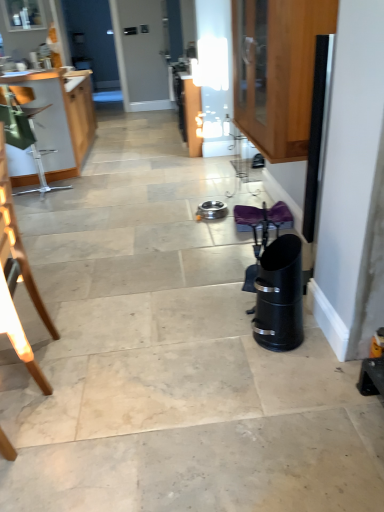
What do you see at coordinates (62, 118) in the screenshot?
I see `wooden cabinet at left, acting as the 2th cabinetry starting from the front` at bounding box center [62, 118].

What do you see at coordinates (17, 278) in the screenshot? This screenshot has height=512, width=384. I see `wooden chair at left` at bounding box center [17, 278].

You are a GUI agent. You are given a task and a screenshot of the screen. Output one action in this format:
    pyautogui.click(x=<x>, y=<y>)
    Task: Click on the wooden cabinet at upper right, which appears as the 1th cabinetry when viewed from the front
    The image size is (384, 512).
    Given the screenshot: What is the action you would take?
    pyautogui.click(x=277, y=71)

This screenshot has height=512, width=384. What do you see at coordinates (277, 71) in the screenshot?
I see `wooden cabinet at upper right, which appears as the 1th cabinetry when viewed from the front` at bounding box center [277, 71].

You are a GUI agent. You are given a task and a screenshot of the screen. Output one action in this format:
    pyautogui.click(x=<x>, y=<y>)
    Task: Click on the wooden cabinet at left, which is the first cabinetry in left-to-right order
    
    Given the screenshot: What is the action you would take?
    pyautogui.click(x=62, y=118)

Is wooden chair at left positioned behind wooden cabinet at left, which is the first cabinetry in left-to-right order?

That is False.

From the image's perspective, is wooden chair at left beneath wooden cabinet at left, which is the first cabinetry in left-to-right order?

Correct, wooden chair at left appears lower than wooden cabinet at left, which is the first cabinetry in left-to-right order, in the image.

Is wooden chair at left next to wooden cabinet at left, which is the first cabinetry in left-to-right order?

No, wooden chair at left is not making contact with wooden cabinet at left, which is the first cabinetry in left-to-right order.

Which object is positioned more to the left, wooden chair at left or wooden cabinet at left, which is the first cabinetry in left-to-right order?

From the viewer's perspective, wooden cabinet at left, which is the first cabinetry in left-to-right order, appears more on the left side.

Which of these two, wooden cabinet at left, the 2th cabinetry positioned from the right, or wooden cabinet at upper right, positioned as the 1th cabinetry in right-to-left order, is smaller?

wooden cabinet at upper right, positioned as the 1th cabinetry in right-to-left order.

Does wooden cabinet at left, which is the first cabinetry in left-to-right order, turn towards wooden cabinet at upper right, placed as the 2th cabinetry when sorted from back to front?

No, wooden cabinet at left, which is the first cabinetry in left-to-right order, is not facing towards wooden cabinet at upper right, placed as the 2th cabinetry when sorted from back to front.

Where is `cabinetry that is above the wooden cabinet at left, acting as the 2th cabinetry starting from the front (from a real-world perspective)`? cabinetry that is above the wooden cabinet at left, acting as the 2th cabinetry starting from the front (from a real-world perspective) is located at coordinates (277, 71).

Is wooden cabinet at left, acting as the 2th cabinetry starting from the front, next to wooden cabinet at upper right, which appears as the 1th cabinetry when viewed from the front, and touching it?

No, wooden cabinet at left, acting as the 2th cabinetry starting from the front, is not in contact with wooden cabinet at upper right, which appears as the 1th cabinetry when viewed from the front.

Is wooden cabinet at upper right, positioned as the 1th cabinetry in right-to-left order, oriented towards wooden cabinet at left, acting as the 2th cabinetry starting from the front?

No, wooden cabinet at upper right, positioned as the 1th cabinetry in right-to-left order, is not oriented towards wooden cabinet at left, acting as the 2th cabinetry starting from the front.

Is wooden cabinet at upper right, placed as the 2th cabinetry when sorted from back to front, next to wooden cabinet at left, which is the first cabinetry in left-to-right order?

wooden cabinet at upper right, placed as the 2th cabinetry when sorted from back to front, and wooden cabinet at left, which is the first cabinetry in left-to-right order, are not in contact.

Considering the sizes of objects wooden cabinet at upper right, which ranks as the 2th cabinetry in left-to-right order, and wooden cabinet at left, which is the 1th cabinetry from back to front, in the image provided, who is bigger, wooden cabinet at upper right, which ranks as the 2th cabinetry in left-to-right order, or wooden cabinet at left, which is the 1th cabinetry from back to front,?

wooden cabinet at left, which is the 1th cabinetry from back to front, is bigger.

Visually, is wooden cabinet at upper right, which appears as the 1th cabinetry when viewed from the front, positioned to the left or to the right of wooden cabinet at left, acting as the 2th cabinetry starting from the front?

In the image, wooden cabinet at upper right, which appears as the 1th cabinetry when viewed from the front, appears on the right side of wooden cabinet at left, acting as the 2th cabinetry starting from the front.

Between wooden cabinet at left, acting as the 2th cabinetry starting from the front, and wooden chair at left, which one is positioned in front?

wooden chair at left is more forward.

Does point (77, 73) appear closer or farther from the camera than point (7, 255)?

Clearly, point (77, 73) is more distant from the camera than point (7, 255).

Measure the distance from wooden cabinet at left, the 2th cabinetry positioned from the right, to wooden chair at left.

A distance of 2.40 meters exists between wooden cabinet at left, the 2th cabinetry positioned from the right, and wooden chair at left.

Is wooden cabinet at left, the 2th cabinetry positioned from the right, not inside wooden chair at left?

wooden cabinet at left, the 2th cabinetry positioned from the right, is positioned outside wooden chair at left.

Does wooden chair at left have a greater height compared to wooden cabinet at upper right, which ranks as the 2th cabinetry in left-to-right order?

Correct, wooden chair at left is much taller as wooden cabinet at upper right, which ranks as the 2th cabinetry in left-to-right order.

Looking at this image, is wooden cabinet at upper right, positioned as the 1th cabinetry in right-to-left order, surrounded by wooden chair at left?

Definitely not — wooden cabinet at upper right, positioned as the 1th cabinetry in right-to-left order, is not inside wooden chair at left.

Does wooden chair at left appear on the right side of wooden cabinet at upper right, which ranks as the 2th cabinetry in left-to-right order?

No.

Considering the sizes of objects wooden chair at left and wooden cabinet at upper right, which ranks as the 2th cabinetry in left-to-right order, in the image provided, who is smaller, wooden chair at left or wooden cabinet at upper right, which ranks as the 2th cabinetry in left-to-right order,?

Smaller between the two is wooden chair at left.

Visually, is wooden cabinet at upper right, which appears as the 1th cabinetry when viewed from the front, positioned to the left or to the right of wooden chair at left?

In the image, wooden cabinet at upper right, which appears as the 1th cabinetry when viewed from the front, appears on the right side of wooden chair at left.

Based on the photo, considering the positions of objects wooden cabinet at upper right, which ranks as the 2th cabinetry in left-to-right order, and wooden chair at left in the image provided, who is in front, wooden cabinet at upper right, which ranks as the 2th cabinetry in left-to-right order, or wooden chair at left?

wooden chair at left is in front.

Do you think wooden cabinet at upper right, placed as the 2th cabinetry when sorted from back to front, is within wooden chair at left, or outside of it?

wooden cabinet at upper right, placed as the 2th cabinetry when sorted from back to front, is spatially situated outside wooden chair at left.

Is there a large distance between wooden cabinet at upper right, which ranks as the 2th cabinetry in left-to-right order, and wooden chair at left?

wooden cabinet at upper right, which ranks as the 2th cabinetry in left-to-right order, is positioned a significant distance from wooden chair at left.

Where is `chair in front of the wooden cabinet at left, acting as the 2th cabinetry starting from the front`? chair in front of the wooden cabinet at left, acting as the 2th cabinetry starting from the front is located at coordinates [x=17, y=278].

This screenshot has width=384, height=512. I want to click on cabinetry on the left side of wooden cabinet at upper right, which ranks as the 2th cabinetry in left-to-right order, so click(x=62, y=118).

Based on their spatial positions, is wooden chair at left or wooden cabinet at upper right, which ranks as the 2th cabinetry in left-to-right order, further from wooden cabinet at left, which is the first cabinetry in left-to-right order?

The object further to wooden cabinet at left, which is the first cabinetry in left-to-right order, is wooden chair at left.

Looking at the image, which one is located further to wooden cabinet at left, which is the first cabinetry in left-to-right order, wooden cabinet at upper right, which appears as the 1th cabinetry when viewed from the front, or wooden chair at left?

wooden chair at left is further to wooden cabinet at left, which is the first cabinetry in left-to-right order.

When comparing their distances from wooden chair at left, does wooden cabinet at left, the 2th cabinetry positioned from the right, or wooden cabinet at upper right, which ranks as the 2th cabinetry in left-to-right order, seem further?

The object further to wooden chair at left is wooden cabinet at left, the 2th cabinetry positioned from the right.

In the scene shown: Considering their positions, is wooden cabinet at left, the 2th cabinetry positioned from the right, positioned further to wooden cabinet at upper right, which ranks as the 2th cabinetry in left-to-right order, than wooden chair at left?

wooden cabinet at left, the 2th cabinetry positioned from the right.

Estimate the real-world distances between objects in this image. Which object is closer to wooden chair at left, wooden cabinet at upper right, which appears as the 1th cabinetry when viewed from the front, or wooden cabinet at left, acting as the 2th cabinetry starting from the front?

Among the two, wooden cabinet at upper right, which appears as the 1th cabinetry when viewed from the front, is located nearer to wooden chair at left.

When comparing their distances from wooden cabinet at upper right, which ranks as the 2th cabinetry in left-to-right order, does wooden chair at left or wooden cabinet at left, which is the first cabinetry in left-to-right order, seem further?

wooden cabinet at left, which is the first cabinetry in left-to-right order, lies further to wooden cabinet at upper right, which ranks as the 2th cabinetry in left-to-right order, than the other object.

What are the coordinates of `chair between wooden cabinet at left, which is the 1th cabinetry from back to front, and wooden cabinet at upper right, placed as the 2th cabinetry when sorted from back to front, in the horizontal direction` in the screenshot? It's located at click(x=17, y=278).